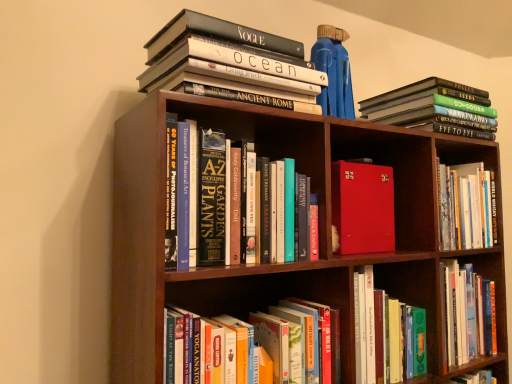
What do you see at coordinates (435, 108) in the screenshot?
I see `hardcover books at upper right, which is the 4th book in bottom-to-top order` at bounding box center [435, 108].

This screenshot has width=512, height=384. Describe the element at coordinates (232, 63) in the screenshot. I see `hardcover book at upper left, which is the 5th book in bottom-to-top order` at that location.

This screenshot has width=512, height=384. Describe the element at coordinates (195, 196) in the screenshot. I see `hardcover book at center, marked as the 3th book in a bottom-to-top arrangement` at that location.

You are a GUI agent. You are given a task and a screenshot of the screen. Output one action in this format:
    pyautogui.click(x=<x>, y=<y>)
    Task: Click on the hardcover book at lower center, which ranks as the first book in bottom-to-top order
    The height and width of the screenshot is (384, 512).
    Given the screenshot: What is the action you would take?
    (247, 345)

From a real-world perspective, is hardcover books at upper right, which is the 4th book in bottom-to-top order, below hardcover book at upper left, which is the 5th book in bottom-to-top order?

Correct, in the physical world, hardcover books at upper right, which is the 4th book in bottom-to-top order, is lower than hardcover book at upper left, which is the 5th book in bottom-to-top order.

Is point (362, 117) behind point (164, 52)?

Yes.

Can hardcover book at upper left, which is the 5th book in bottom-to-top order, be found inside hardcover books at upper right, positioned as the 2th book in top-to-bottom order?

No, hardcover books at upper right, positioned as the 2th book in top-to-bottom order, does not contain hardcover book at upper left, which is the 5th book in bottom-to-top order.

Is the surface of hardcover book at upper left, the 1th book positioned from the top, in direct contact with hardcover book at lower center, which ranks as the first book in bottom-to-top order?

No, hardcover book at upper left, the 1th book positioned from the top, is not touching hardcover book at lower center, which ranks as the first book in bottom-to-top order.

Consider the image. From a real-world perspective, is hardcover book at upper left, which is the 5th book in bottom-to-top order, positioned over hardcover book at lower center, the 5th book positioned from the top, based on gravity?

Yes, from a real-world perspective, hardcover book at upper left, which is the 5th book in bottom-to-top order, is above hardcover book at lower center, the 5th book positioned from the top.

Is hardcover book at upper left, the 1th book positioned from the top, not within hardcover book at lower center, which ranks as the first book in bottom-to-top order?

Yes, hardcover book at upper left, the 1th book positioned from the top, is not within hardcover book at lower center, which ranks as the first book in bottom-to-top order.

Who is bigger, hardcover book at upper left, which is the 5th book in bottom-to-top order, or hardcover book at lower center, which ranks as the first book in bottom-to-top order?

hardcover book at upper left, which is the 5th book in bottom-to-top order, is bigger.

Does hardcover book at lower center, which ranks as the first book in bottom-to-top order, touch hardcover book at center, the third book positioned from the top?

No, hardcover book at lower center, which ranks as the first book in bottom-to-top order, is not with hardcover book at center, the third book positioned from the top.

Identify the location of book that is the 2nd object directly below the hardcover book at center, marked as the 3th book in a bottom-to-top arrangement (from a real-world perspective). (247, 345).

Does point (268, 335) come in front of point (170, 211)?

No.

Is hardcover book at lower center, which ranks as the first book in bottom-to-top order, taller or shorter than hardcover book at center, the third book positioned from the top?

hardcover book at lower center, which ranks as the first book in bottom-to-top order, is shorter than hardcover book at center, the third book positioned from the top.

Looking at the image, does hardcover book at lower center, which ranks as the first book in bottom-to-top order, seem bigger or smaller compared to hardcover book at upper left, which is the 5th book in bottom-to-top order?

Considering their sizes, hardcover book at lower center, which ranks as the first book in bottom-to-top order, takes up less space than hardcover book at upper left, which is the 5th book in bottom-to-top order.

Which object is further away from the camera, hardcover book at lower center, the 5th book positioned from the top, or hardcover book at upper left, the 1th book positioned from the top?

hardcover book at upper left, the 1th book positioned from the top, is more distant.

Does hardcover book at lower center, the 5th book positioned from the top, have a lesser width compared to hardcover book at upper left, the 1th book positioned from the top?

Correct, the width of hardcover book at lower center, the 5th book positioned from the top, is less than that of hardcover book at upper left, the 1th book positioned from the top.

Find the location of a particular element. the 4th book above the hardcover book at lower center, the 5th book positioned from the top (from the image's perspective) is located at coordinates (232, 63).

Which is more to the left, hardcover book at center, the third book positioned from the top, or hardcover books at upper right, which is the 4th book in bottom-to-top order?

hardcover book at center, the third book positioned from the top.

In the image, is hardcover book at center, the third book positioned from the top, positioned in front of or behind hardcover books at upper right, positioned as the 2th book in top-to-bottom order?

hardcover book at center, the third book positioned from the top, is positioned closer to the viewer than hardcover books at upper right, positioned as the 2th book in top-to-bottom order.

In terms of width, does hardcover book at center, the third book positioned from the top, look wider or thinner when compared to hardcover books at upper right, positioned as the 2th book in top-to-bottom order?

Considering their sizes, hardcover book at center, the third book positioned from the top, looks slimmer than hardcover books at upper right, positioned as the 2th book in top-to-bottom order.

From a real-world perspective, does hardcover book at center, the third book positioned from the top, stand above hardcover books at upper right, positioned as the 2th book in top-to-bottom order?

No.

Based on their positions, is hardcover book at lower center, which ranks as the first book in bottom-to-top order, located to the left or right of hardcover books at upper right, positioned as the 2th book in top-to-bottom order?

Based on their positions, hardcover book at lower center, which ranks as the first book in bottom-to-top order, is located to the left of hardcover books at upper right, positioned as the 2th book in top-to-bottom order.

Considering the sizes of objects hardcover book at lower center, the 5th book positioned from the top, and hardcover books at upper right, which is the 4th book in bottom-to-top order, in the image provided, who is taller, hardcover book at lower center, the 5th book positioned from the top, or hardcover books at upper right, which is the 4th book in bottom-to-top order,?

Standing taller between the two is hardcover book at lower center, the 5th book positioned from the top.

Which object is wider, hardcover book at lower center, the 5th book positioned from the top, or hardcover books at upper right, which is the 4th book in bottom-to-top order?

With larger width is hardcover books at upper right, which is the 4th book in bottom-to-top order.

From the image's perspective, which one is positioned lower, hardcover book at lower center, which ranks as the first book in bottom-to-top order, or hardcover books at upper right, positioned as the 2th book in top-to-bottom order?

hardcover book at lower center, which ranks as the first book in bottom-to-top order, is shown below in the image.

From the image's perspective, between hardcover books at upper right, positioned as the 2th book in top-to-bottom order, and red leather-bound book at center, which is counted as the 2th book, starting from the bottom, which one is located above?

hardcover books at upper right, positioned as the 2th book in top-to-bottom order, is shown above in the image.

Based on their sizes in the image, would you say hardcover books at upper right, positioned as the 2th book in top-to-bottom order, is bigger or smaller than red leather-bound book at center, which is the fourth book in top-to-bottom order?

In the image, hardcover books at upper right, positioned as the 2th book in top-to-bottom order, appears to be larger than red leather-bound book at center, which is the fourth book in top-to-bottom order.

Is hardcover books at upper right, positioned as the 2th book in top-to-bottom order, facing away from red leather-bound book at center, which is counted as the 2th book, starting from the bottom?

hardcover books at upper right, positioned as the 2th book in top-to-bottom order, is not turned away from red leather-bound book at center, which is counted as the 2th book, starting from the bottom.

From a real-world perspective, is hardcover books at upper right, positioned as the 2th book in top-to-bottom order, physically above red leather-bound book at center, which is counted as the 2th book, starting from the bottom?

Yes, from a real-world perspective, hardcover books at upper right, positioned as the 2th book in top-to-bottom order, is over red leather-bound book at center, which is counted as the 2th book, starting from the bottom

Where is `book that appears above the hardcover books at upper right, which is the 4th book in bottom-to-top order (from the image's perspective)`? book that appears above the hardcover books at upper right, which is the 4th book in bottom-to-top order (from the image's perspective) is located at coordinates tap(232, 63).

Locate an element on the screen. The image size is (512, 384). the 2nd book in front of the hardcover book at upper left, the 1th book positioned from the top is located at coordinates (247, 345).

Considering their positions, is hardcover book at center, marked as the 3th book in a bottom-to-top arrangement, positioned further to red leather-bound book at center, which is counted as the 2th book, starting from the bottom, than hardcover book at upper left, which is the 5th book in bottom-to-top order?

Based on the image, hardcover book at center, marked as the 3th book in a bottom-to-top arrangement, appears to be further to red leather-bound book at center, which is counted as the 2th book, starting from the bottom.

Based on their spatial positions, is hardcover books at upper right, positioned as the 2th book in top-to-bottom order, or hardcover book at center, marked as the 3th book in a bottom-to-top arrangement, closer to hardcover book at upper left, which is the 5th book in bottom-to-top order?

Among the two, hardcover book at center, marked as the 3th book in a bottom-to-top arrangement, is located nearer to hardcover book at upper left, which is the 5th book in bottom-to-top order.

When comparing their distances from red leather-bound book at center, which is the fourth book in top-to-bottom order, does hardcover book at lower center, the 5th book positioned from the top, or hardcover books at upper right, positioned as the 2th book in top-to-bottom order, seem further?

Based on the image, hardcover book at lower center, the 5th book positioned from the top, appears to be further to red leather-bound book at center, which is the fourth book in top-to-bottom order.

From the image, which object appears to be farther from hardcover books at upper right, which is the 4th book in bottom-to-top order, hardcover book at lower center, the 5th book positioned from the top, or hardcover book at upper left, which is the 5th book in bottom-to-top order?

hardcover book at lower center, the 5th book positioned from the top, is further to hardcover books at upper right, which is the 4th book in bottom-to-top order.

Considering their positions, is hardcover book at center, the third book positioned from the top, positioned further to hardcover book at lower center, the 5th book positioned from the top, than red leather-bound book at center, which is the fourth book in top-to-bottom order?

red leather-bound book at center, which is the fourth book in top-to-bottom order.

Based on their spatial positions, is hardcover books at upper right, which is the 4th book in bottom-to-top order, or hardcover book at lower center, the 5th book positioned from the top, further from red leather-bound book at center, which is the fourth book in top-to-bottom order?

The object further to red leather-bound book at center, which is the fourth book in top-to-bottom order, is hardcover book at lower center, the 5th book positioned from the top.

When comparing their distances from hardcover book at center, marked as the 3th book in a bottom-to-top arrangement, does hardcover books at upper right, positioned as the 2th book in top-to-bottom order, or hardcover book at lower center, the 5th book positioned from the top, seem further?

hardcover books at upper right, positioned as the 2th book in top-to-bottom order, lies further to hardcover book at center, marked as the 3th book in a bottom-to-top arrangement, than the other object.

From the picture: Considering their positions, is red leather-bound book at center, which is the fourth book in top-to-bottom order, positioned further to hardcover book at center, marked as the 3th book in a bottom-to-top arrangement, than hardcover book at lower center, the 5th book positioned from the top?

red leather-bound book at center, which is the fourth book in top-to-bottom order, is further to hardcover book at center, marked as the 3th book in a bottom-to-top arrangement.

The height and width of the screenshot is (384, 512). Identify the location of book between hardcover book at center, marked as the 3th book in a bottom-to-top arrangement, and hardcover book at lower center, the 5th book positioned from the top, in the up-down direction. (362, 207).